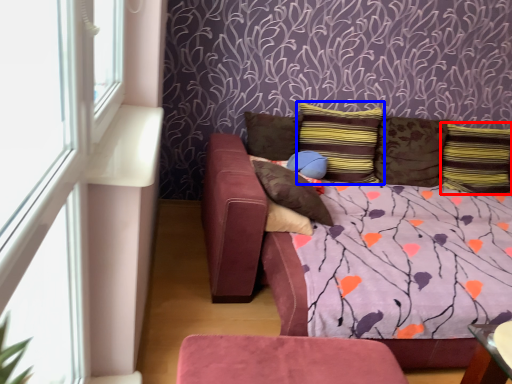
Question: Which object is closer to the camera taking this photo, pillow (highlighted by a red box) or pillow (highlighted by a blue box)?

Choices:
 (A) pillow
 (B) pillow

Answer: (B)